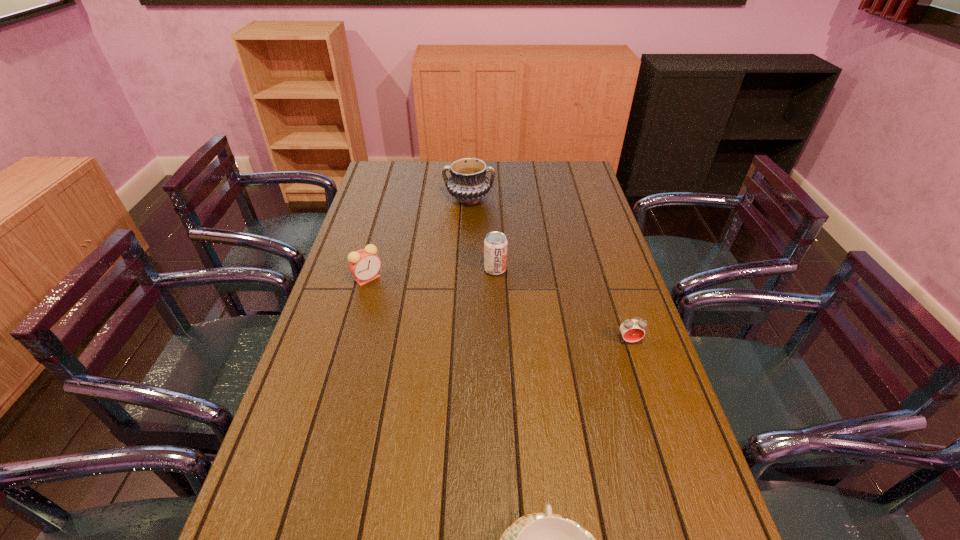
Locate an element on the screen. The width and height of the screenshot is (960, 540). object present at the far edge is located at coordinates (468, 183).

This screenshot has height=540, width=960. What are the coordinates of `object positioned at the left edge` in the screenshot? It's located at (364, 264).

You are a GUI agent. You are given a task and a screenshot of the screen. Output one action in this format:
    pyautogui.click(x=<x>, y=<y>)
    Task: Click on the object present at the right edge
    The image size is (960, 540).
    Given the screenshot: What is the action you would take?
    pyautogui.click(x=632, y=330)

In order to click on vacant space at the far edge of the desktop in this screenshot , I will do `click(415, 171)`.

This screenshot has height=540, width=960. I want to click on free space at the left edge of the desktop, so click(379, 205).

You are a GUI agent. You are given a task and a screenshot of the screen. Output one action in this format:
    pyautogui.click(x=<x>, y=<y>)
    Task: Click on the vacant point at the right edge
    
    Given the screenshot: What is the action you would take?
    pyautogui.click(x=593, y=191)

The height and width of the screenshot is (540, 960). I want to click on vacant space at the far left corner of the desktop, so click(388, 190).

At what (x,y) coordinates should I click in order to perform the action: click on free space at the far right corner of the desktop. Please return your answer as a coordinate pair (x, y). This screenshot has height=540, width=960. Looking at the image, I should click on [x=581, y=182].

Where is `free space between the rightmost object and the soda can`? This screenshot has width=960, height=540. free space between the rightmost object and the soda can is located at coordinates (562, 305).

Locate an element on the screen. unoccupied area between the left alarm clock and the right alarm clock is located at coordinates (498, 309).